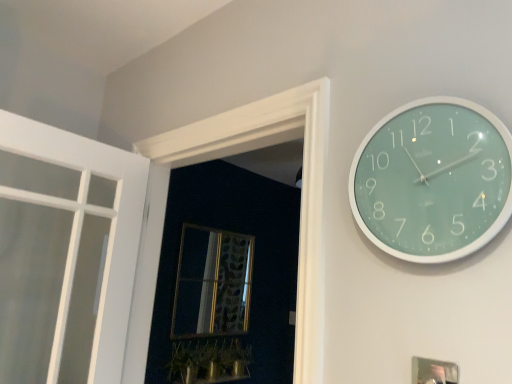
Question: Is gold-framed mirror at center taller than teal glossy clock at upper right?

Choices:
 (A) no
 (B) yes

Answer: (B)

Question: Is teal glossy clock at upper right completely or partially inside gold-framed mirror at center?

Choices:
 (A) yes
 (B) no

Answer: (B)

Question: Can you confirm if gold-framed mirror at center is positioned to the right of teal glossy clock at upper right?

Choices:
 (A) no
 (B) yes

Answer: (A)

Question: Is the depth of gold-framed mirror at center less than that of teal glossy clock at upper right?

Choices:
 (A) no
 (B) yes

Answer: (A)

Question: Does gold-framed mirror at center have a smaller size compared to teal glossy clock at upper right?

Choices:
 (A) no
 (B) yes

Answer: (A)

Question: From a real-world perspective, is metallic silver picture frame at lower right physically located above or below gold-framed mirror at center?

Choices:
 (A) below
 (B) above

Answer: (A)

Question: Is metallic silver picture frame at lower right wider or thinner than gold-framed mirror at center?

Choices:
 (A) thin
 (B) wide

Answer: (A)

Question: Which is correct: metallic silver picture frame at lower right is inside gold-framed mirror at center, or outside of it?

Choices:
 (A) outside
 (B) inside

Answer: (A)

Question: From the image's perspective, relative to gold-framed mirror at center, is metallic silver picture frame at lower right above or below?

Choices:
 (A) above
 (B) below

Answer: (A)

Question: Visually, is metallic silver picture frame at lower right positioned to the left or to the right of green glossy plant at lower center?

Choices:
 (A) left
 (B) right

Answer: (B)

Question: Looking at their shapes, would you say metallic silver picture frame at lower right is wider or thinner than green glossy plant at lower center?

Choices:
 (A) wide
 (B) thin

Answer: (B)

Question: Is point (443, 382) closer or farther from the camera than point (220, 369)?

Choices:
 (A) farther
 (B) closer

Answer: (B)

Question: From a real-world perspective, is metallic silver picture frame at lower right physically located above or below green glossy plant at lower center?

Choices:
 (A) above
 (B) below

Answer: (A)

Question: Relative to metallic silver picture frame at lower right, is gold-framed mirror at center in front or behind?

Choices:
 (A) behind
 (B) front

Answer: (A)

Question: Considering the positions of point (175, 337) and point (437, 360), is point (175, 337) closer or farther from the camera than point (437, 360)?

Choices:
 (A) closer
 (B) farther

Answer: (B)